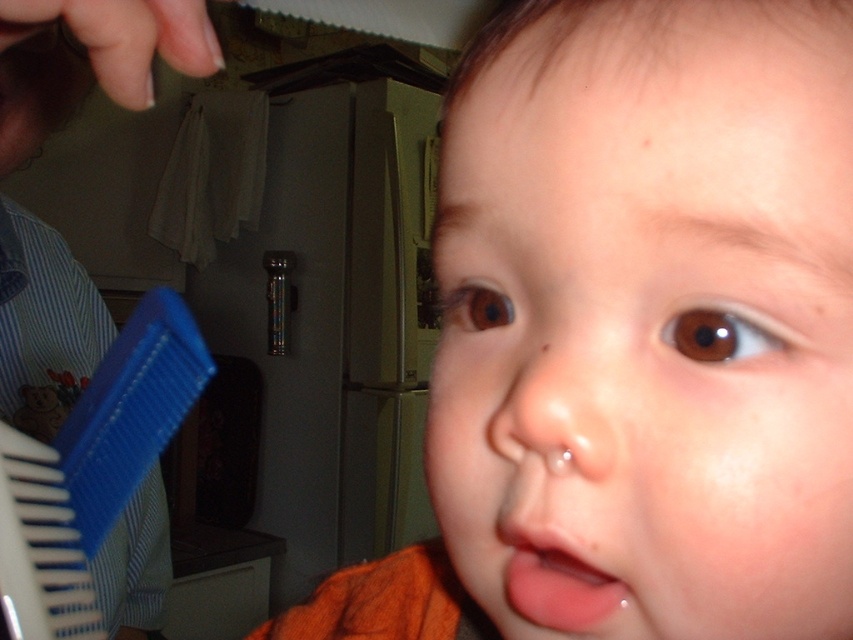
Question: Is smooth skin baby at center to the right of pink glossy lips at center from the viewer's perspective?

Choices:
 (A) no
 (B) yes

Answer: (A)

Question: Estimate the real-world distances between objects in this image. Which object is closer to the smooth skin baby at center?

Choices:
 (A) blue plastic comb at upper left
 (B) pink glossy lips at center

Answer: (B)

Question: Is smooth skin baby at center smaller than blue plastic comb at upper left?

Choices:
 (A) no
 (B) yes

Answer: (B)

Question: Among these points, which one is farthest from the camera?

Choices:
 (A) (456, 81)
 (B) (154, 24)

Answer: (B)

Question: Which point is farther to the camera?

Choices:
 (A) smooth skin baby at center
 (B) pink glossy lips at center

Answer: (B)

Question: From the image, what is the correct spatial relationship of smooth skin baby at center in relation to blue plastic comb at upper left?

Choices:
 (A) right
 (B) left

Answer: (A)